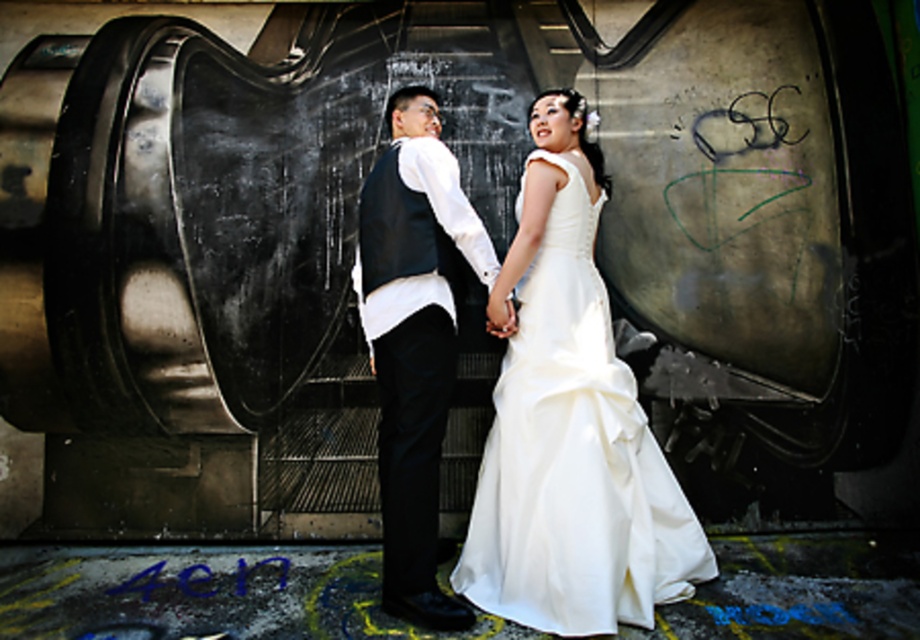
Does white satin dress at center appear on the right side of matte black vest at center?

Yes, white satin dress at center is to the right of matte black vest at center.

Does point (558, 531) lie in front of point (452, 364)?

Yes, point (558, 531) is closer to viewer.

The width and height of the screenshot is (920, 640). Identify the location of white satin dress at center. (573, 456).